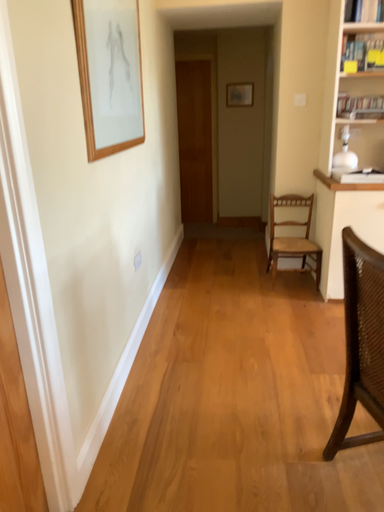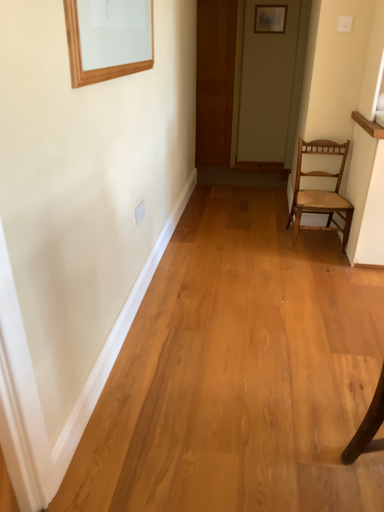
Question: Which way did the camera rotate in the video?

Choices:
 (A) rotated downward
 (B) rotated upward

Answer: (A)